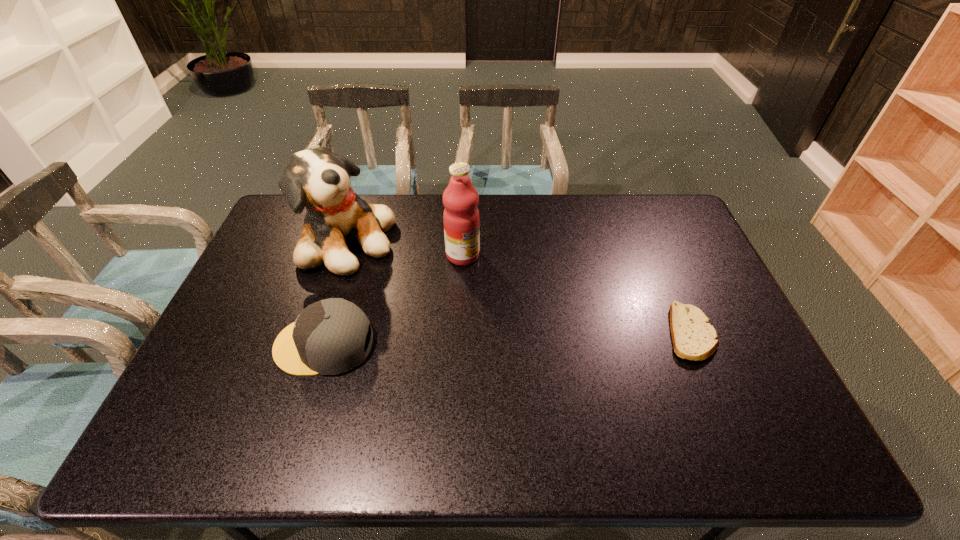
The height and width of the screenshot is (540, 960). What are the coordinates of `free spot between the cap and the second object from right to left` in the screenshot? It's located at (394, 300).

The height and width of the screenshot is (540, 960). I want to click on vacant area between the pita bread and the fruit juice, so click(577, 294).

I want to click on vacant area that lies between the shortest object and the fruit juice, so click(x=577, y=294).

What are the coordinates of `vacant point located between the puppy and the rightmost object` in the screenshot? It's located at (518, 288).

Identify which object is located as the third nearest to the second shortest object. Please provide its 2D coordinates. Your answer should be formatted as a tuple, i.e. [(x, y)], where the tuple contains the x and y coordinates of a point satisfying the conditions above.

[(694, 338)]

The width and height of the screenshot is (960, 540). I want to click on object that is the third closest to the cap, so click(x=694, y=338).

Locate an element on the screen. This screenshot has height=540, width=960. free spot that satisfies the following two spatial constraints: 1. on the front side of the third object from left to right; 2. on the right side of the pita bread is located at coordinates (460, 333).

Locate an element on the screen. blank space that satisfies the following two spatial constraints: 1. on the front side of the puppy; 2. on the right side of the fruit juice is located at coordinates (342, 255).

Find the location of a particular element. This screenshot has width=960, height=540. free space that satisfies the following two spatial constraints: 1. on the front side of the rightmost object; 2. on the left side of the fruit juice is located at coordinates (460, 333).